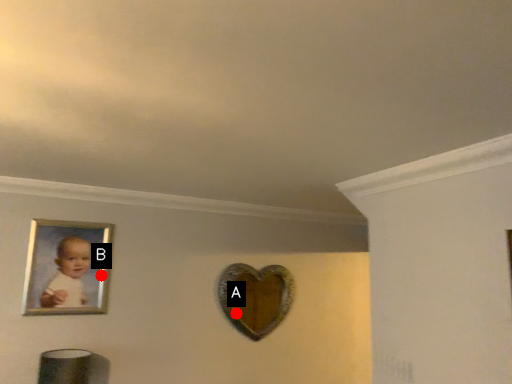
Question: Two points are circled on the image, labeled by A and B beside each circle. Which point is farther from the camera taking this photo?

Choices:
 (A) A is further
 (B) B is further

Answer: (A)